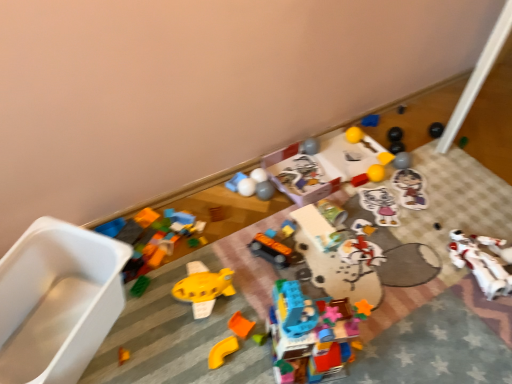
Where is `vacant space that is in between yellow rubber ball at upper center, the 3th toy in the right-to-left sequence, and matte black car at center, the eighth toy positioned from the left`? vacant space that is in between yellow rubber ball at upper center, the 3th toy in the right-to-left sequence, and matte black car at center, the eighth toy positioned from the left is located at coordinates (328, 208).